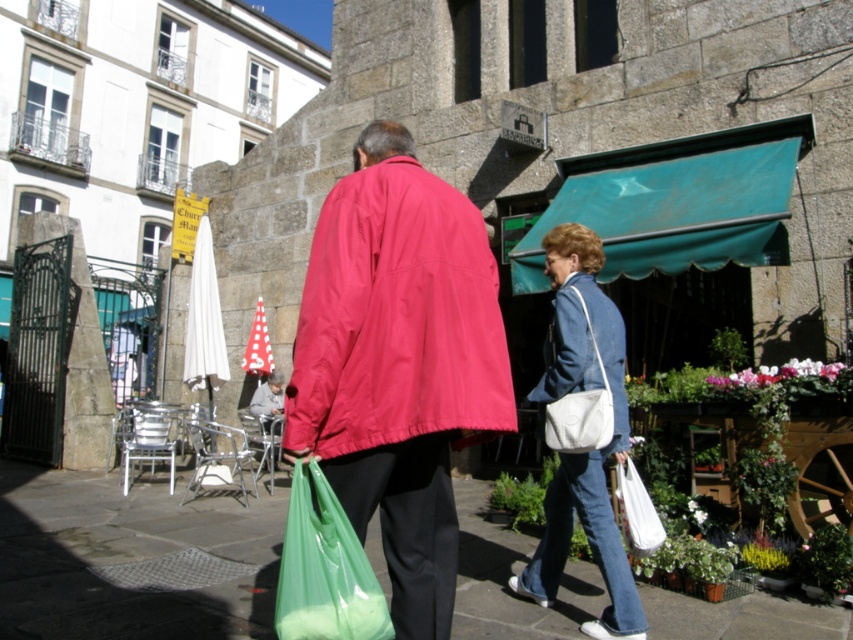
Question: Does green plastic bag at center have a lesser width compared to denim jacket at center?

Choices:
 (A) yes
 (B) no

Answer: (B)

Question: Among these points, which one is farthest from the camera?

Choices:
 (A) (276, 540)
 (B) (587, 342)
 (C) (352, 586)

Answer: (A)

Question: Is green plastic bag at lower center thinner than denim jacket at lower right?

Choices:
 (A) yes
 (B) no

Answer: (A)

Question: Based on their relative distances, which object is nearer to the matte red jacket at center?

Choices:
 (A) green plastic bag at center
 (B) green plastic bag at lower center

Answer: (B)

Question: Can you confirm if green plastic bag at center is smaller than denim jacket at lower right?

Choices:
 (A) no
 (B) yes

Answer: (B)

Question: Which object appears farthest from the camera in this image?

Choices:
 (A) denim jacket at lower right
 (B) green plastic bag at lower center
 (C) green plastic bag at center
 (D) matte red jacket at center

Answer: (C)